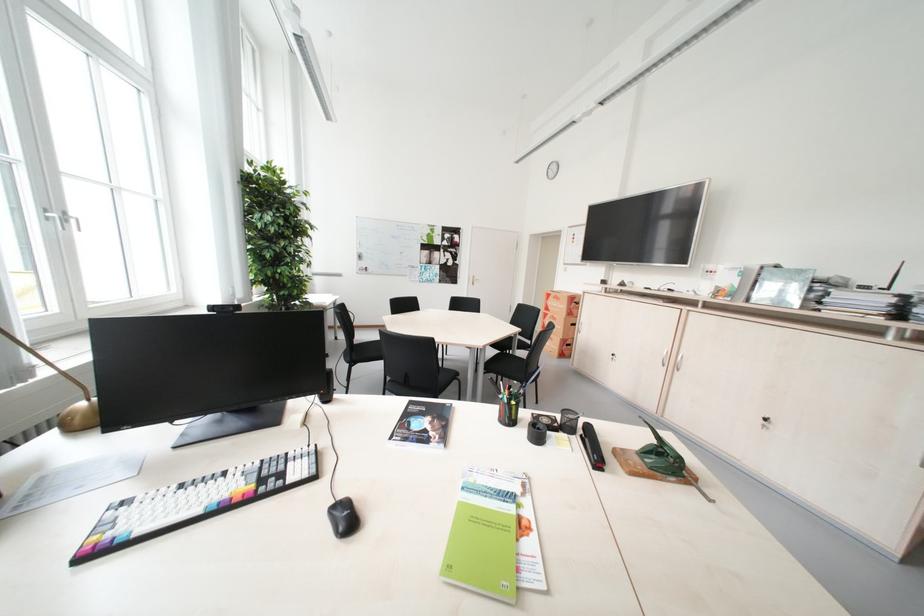
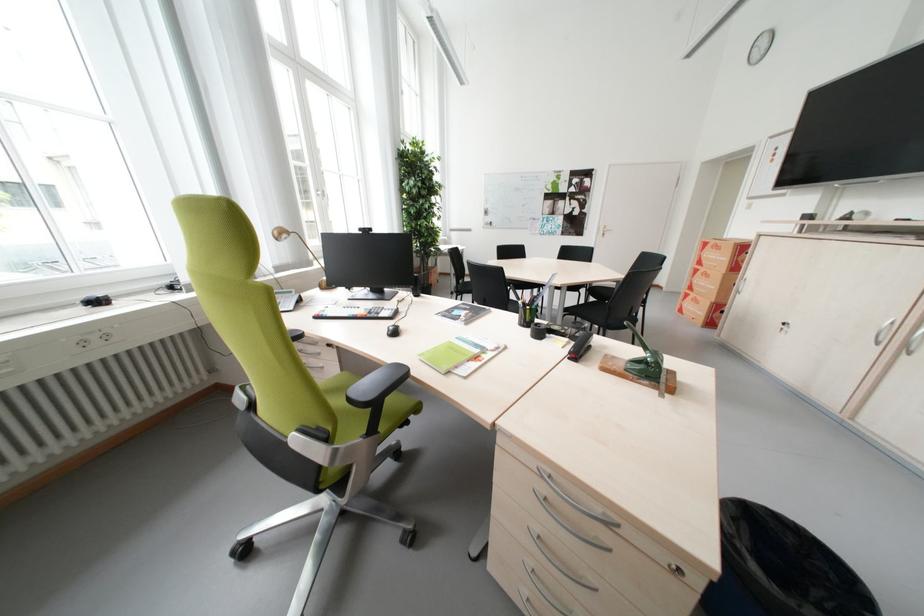
Question: The camera is either moving clockwise (left) or counter-clockwise (right) around the object. The first image is from the beginning of the video and the second image is from the end. Is the camera moving left or right when shooting the video?

Choices:
 (A) Left
 (B) Right

Answer: (B)